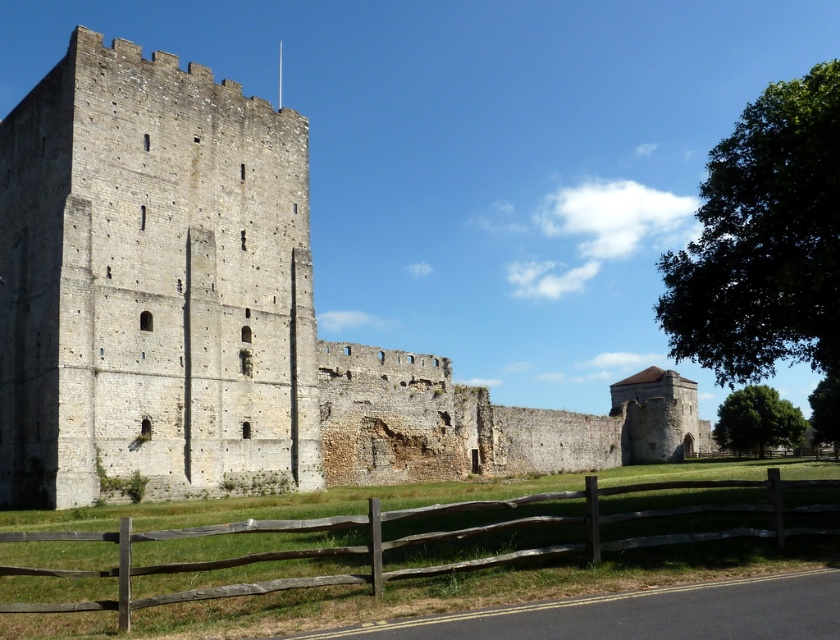
Question: Which object is farther from the camera taking this photo?

Choices:
 (A) brown wooden fence at lower center
 (B) stone wall at left

Answer: (B)

Question: Which point is closer to the camera?

Choices:
 (A) brown wooden fence at lower center
 (B) stone wall at left

Answer: (A)

Question: Is stone wall at left further to the viewer compared to brown wooden fence at lower center?

Choices:
 (A) yes
 (B) no

Answer: (A)

Question: Does stone wall at left appear on the right side of brown wooden fence at lower center?

Choices:
 (A) yes
 (B) no

Answer: (A)

Question: Does stone wall at left come behind brown wooden fence at lower center?

Choices:
 (A) no
 (B) yes

Answer: (B)